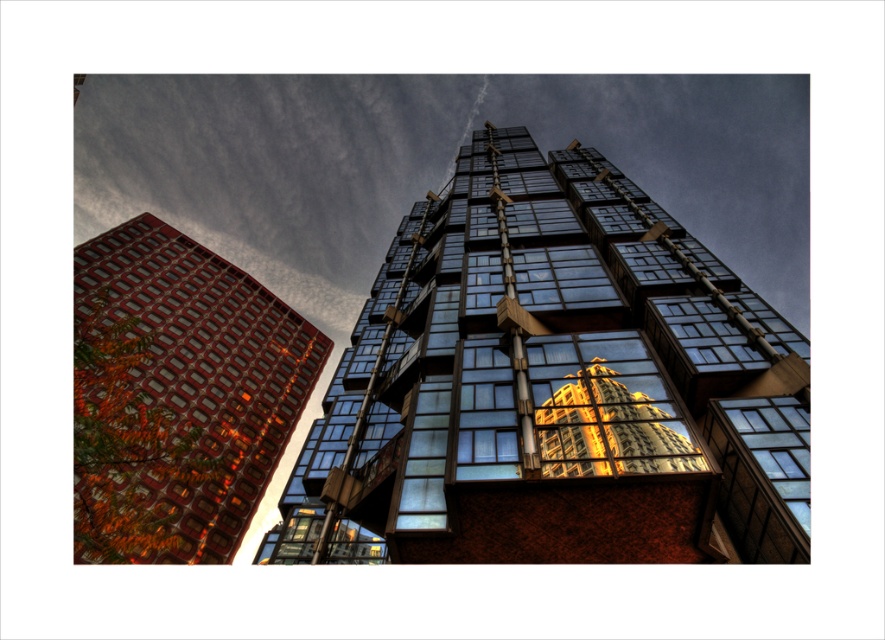
You are an architect analyzing the urban scene. You notice the glassy reflective building at center and the glossy glass building at center. Which of these two buildings has a greater visual impact due to its size?

The glassy reflective building at center has a larger size compared to the glossy glass building at center, making it more visually impactful due to its size.

You are standing at the edge of the street looking at the glassy reflective building at center. If you walk straight towards it for 50 feet, how far will you be from the building?

After walking 50 feet towards the glassy reflective building at center, you will be 58.86 feet away from it.